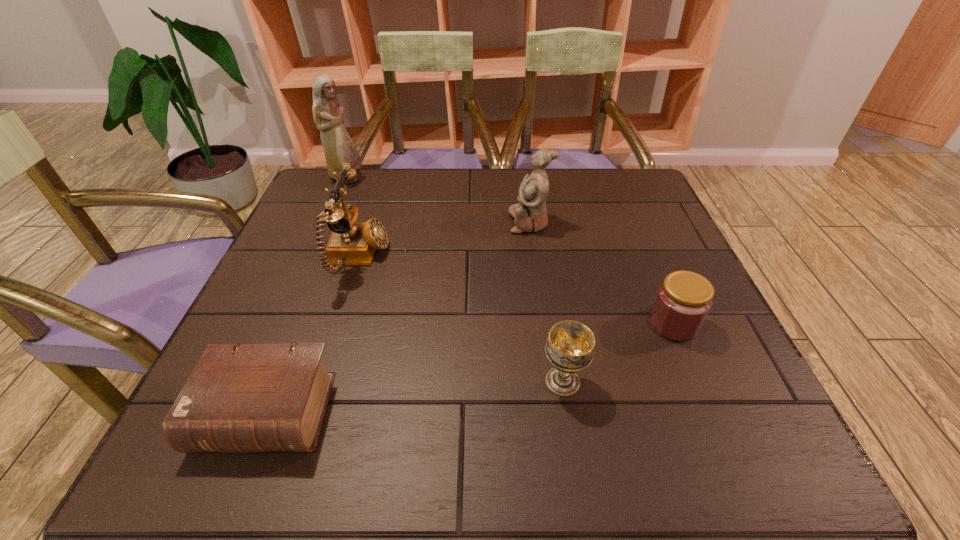
Find the location of `the farther figurine`. the farther figurine is located at coordinates (339, 148).

This screenshot has width=960, height=540. I want to click on the farthest object, so (x=339, y=148).

Find the location of a particular element. The image size is (960, 540). the right figurine is located at coordinates (530, 214).

The image size is (960, 540). What are the coordinates of `the shorter figurine` in the screenshot? It's located at (530, 214).

Locate an element on the screen. The height and width of the screenshot is (540, 960). telephone is located at coordinates (352, 242).

Locate an element on the screen. The height and width of the screenshot is (540, 960). chalice is located at coordinates (570, 347).

In order to click on the rightmost object in this screenshot , I will do `click(683, 300)`.

At what (x,y) coordinates should I click in order to perform the action: click on jam. Please return your answer as a coordinate pair (x, y). Looking at the image, I should click on (683, 300).

At what (x,y) coordinates should I click in order to perform the action: click on Bible. Please return your answer as a coordinate pair (x, y). The image size is (960, 540). Looking at the image, I should click on (240, 398).

The image size is (960, 540). I want to click on vacant space situated on the front-facing side of the left figurine, so click(392, 178).